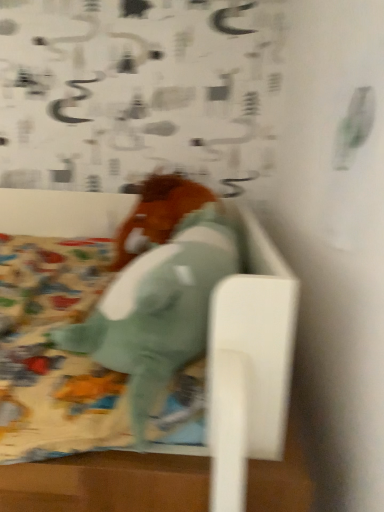
Question: Could you tell me if soft teal plush horse at center, the second animal from the back, is facing brown matte horse at center, the first animal when ordered from back to front?

Choices:
 (A) yes
 (B) no

Answer: (B)

Question: Is brown matte horse at center, the 2th animal positioned from the front, located within soft teal plush horse at center, the second animal from the back?

Choices:
 (A) yes
 (B) no

Answer: (B)

Question: Is soft teal plush horse at center, the second animal from the back, further to camera compared to brown matte horse at center, the first animal when ordered from back to front?

Choices:
 (A) no
 (B) yes

Answer: (A)

Question: From the image's perspective, would you say soft teal plush horse at center, the second animal from the back, is positioned over brown matte horse at center, the 2th animal positioned from the front?

Choices:
 (A) no
 (B) yes

Answer: (A)

Question: Is soft teal plush horse at center, the second animal from the back, smaller than brown matte horse at center, the first animal when ordered from back to front?

Choices:
 (A) yes
 (B) no

Answer: (B)

Question: Can you confirm if soft teal plush horse at center, the second animal from the back, is thinner than brown matte horse at center, the 2th animal positioned from the front?

Choices:
 (A) no
 (B) yes

Answer: (B)

Question: Is brown matte horse at center, the 2th animal positioned from the front, at the right side of soft teal plush horse at center, the second animal from the back?

Choices:
 (A) no
 (B) yes

Answer: (A)

Question: Is brown matte horse at center, the first animal when ordered from back to front, oriented away from soft teal plush horse at center, which ranks as the 1th animal in front-to-back order?

Choices:
 (A) no
 (B) yes

Answer: (A)

Question: Is brown matte horse at center, the 2th animal positioned from the front, closer to camera compared to soft teal plush horse at center, which ranks as the 1th animal in front-to-back order?

Choices:
 (A) no
 (B) yes

Answer: (A)

Question: Would you say soft teal plush horse at center, the second animal from the back, is part of brown matte horse at center, the first animal when ordered from back to front,'s contents?

Choices:
 (A) no
 (B) yes

Answer: (A)

Question: Can you confirm if brown matte horse at center, the first animal when ordered from back to front, is thinner than soft teal plush horse at center, which ranks as the 1th animal in front-to-back order?

Choices:
 (A) no
 (B) yes

Answer: (A)

Question: Considering the relative sizes of brown matte horse at center, the 2th animal positioned from the front, and soft teal plush horse at center, which ranks as the 1th animal in front-to-back order, in the image provided, is brown matte horse at center, the 2th animal positioned from the front, smaller than soft teal plush horse at center, which ranks as the 1th animal in front-to-back order,?

Choices:
 (A) no
 (B) yes

Answer: (B)

Question: From the image's perspective, is soft teal plush horse at center, the second animal from the back, located above or below brown matte horse at center, the 2th animal positioned from the front?

Choices:
 (A) above
 (B) below

Answer: (B)